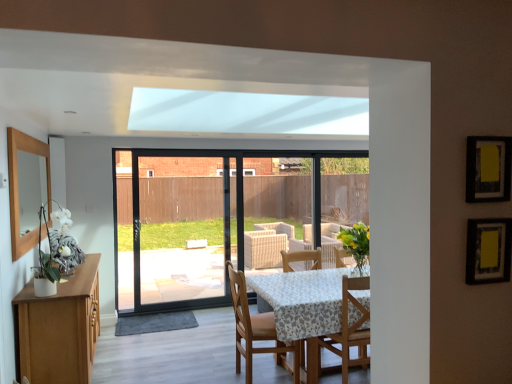
Describe the element at coordinates (349, 331) in the screenshot. The height and width of the screenshot is (384, 512). I see `wooden chair at center, which is counted as the second chair, starting from the left` at that location.

This screenshot has height=384, width=512. Find the location of `wooden chair at center, which is counted as the second chair, starting from the left`. wooden chair at center, which is counted as the second chair, starting from the left is located at coordinates pos(349,331).

Image resolution: width=512 pixels, height=384 pixels. Describe the element at coordinates (255, 328) in the screenshot. I see `wooden chair at center, the 1th chair viewed from the left` at that location.

This screenshot has height=384, width=512. I want to click on wooden chair at center, the 2th chair positioned from the right, so click(x=255, y=328).

Measure the distance between wooden chair at center, the 1th chair viewed from the left, and camera.

The depth of wooden chair at center, the 1th chair viewed from the left, is 3.31 meters.

Locate an element on the screen. The height and width of the screenshot is (384, 512). wooden chair at center, which is counted as the second chair, starting from the left is located at coordinates (349, 331).

Visually, is wooden chair at center, the 1th chair viewed from the left, positioned to the left or to the right of wooden chair at center, placed as the 1th chair when sorted from right to left?

wooden chair at center, the 1th chair viewed from the left, is to the left of wooden chair at center, placed as the 1th chair when sorted from right to left.

Which is behind, wooden chair at center, the 1th chair viewed from the left, or wooden chair at center, which is counted as the second chair, starting from the left?

wooden chair at center, the 1th chair viewed from the left, is more distant.

Is point (229, 271) closer or farther from the camera than point (345, 307)?

Point (229, 271) is farther from the camera than point (345, 307).

From the image's perspective, is wooden chair at center, the 1th chair viewed from the left, beneath wooden chair at center, which is counted as the second chair, starting from the left?

Yes, from the image's perspective, wooden chair at center, the 1th chair viewed from the left, is below wooden chair at center, which is counted as the second chair, starting from the left.

From a real-world perspective, is wooden chair at center, the 1th chair viewed from the left, positioned above or below wooden chair at center, placed as the 1th chair when sorted from right to left?

In terms of real-world spatial position, wooden chair at center, the 1th chair viewed from the left, is below wooden chair at center, placed as the 1th chair when sorted from right to left.

Between wooden chair at center, the 2th chair positioned from the right, and wooden chair at center, placed as the 1th chair when sorted from right to left, which one has larger width?

With larger width is wooden chair at center, the 2th chair positioned from the right.

Is wooden chair at center, the 2th chair positioned from the right, shorter than wooden chair at center, placed as the 1th chair when sorted from right to left?

No, wooden chair at center, the 2th chair positioned from the right, is not shorter than wooden chair at center, placed as the 1th chair when sorted from right to left.

Considering the sizes of objects wooden chair at center, the 1th chair viewed from the left, and wooden chair at center, placed as the 1th chair when sorted from right to left, in the image provided, who is bigger, wooden chair at center, the 1th chair viewed from the left, or wooden chair at center, placed as the 1th chair when sorted from right to left,?

wooden chair at center, the 1th chair viewed from the left, is bigger.

Choose the correct answer: Is wooden chair at center, the 2th chair positioned from the right, inside wooden chair at center, which is counted as the second chair, starting from the left, or outside it?

wooden chair at center, the 2th chair positioned from the right, is not enclosed by wooden chair at center, which is counted as the second chair, starting from the left.

Are wooden chair at center, the 1th chair viewed from the left, and wooden chair at center, which is counted as the second chair, starting from the left, far apart?

wooden chair at center, the 1th chair viewed from the left, is near wooden chair at center, which is counted as the second chair, starting from the left, not far away.

Is wooden chair at center, the 2th chair positioned from the right, oriented away from wooden chair at center, which is counted as the second chair, starting from the left?

No, wooden chair at center, the 2th chair positioned from the right,'s orientation is not away from wooden chair at center, which is counted as the second chair, starting from the left.

You are a GUI agent. You are given a task and a screenshot of the screen. Output one action in this format:
    pyautogui.click(x=<x>, y=<y>)
    Task: Click on the chair in front of the wooden chair at center, the 2th chair positioned from the right
    This screenshot has height=384, width=512.
    Given the screenshot: What is the action you would take?
    pyautogui.click(x=349, y=331)

Is wooden chair at center, which is counted as the second chair, starting from the left, at the right side of wooden chair at center, the 2th chair positioned from the right?

Correct, you'll find wooden chair at center, which is counted as the second chair, starting from the left, to the right of wooden chair at center, the 2th chair positioned from the right.

Does wooden chair at center, which is counted as the second chair, starting from the left, come in front of wooden chair at center, the 1th chair viewed from the left?

Yes, it is.

Which is closer to the camera, (x=347, y=360) or (x=257, y=336)?

Point (x=347, y=360) is closer to the camera than point (x=257, y=336).

From the image's perspective, would you say wooden chair at center, placed as the 1th chair when sorted from right to left, is positioned over wooden chair at center, the 1th chair viewed from the left?

Yes.

From a real-world perspective, is wooden chair at center, placed as the 1th chair when sorted from right to left, physically above wooden chair at center, the 1th chair viewed from the left?

Indeed, from a real-world perspective, wooden chair at center, placed as the 1th chair when sorted from right to left, stands above wooden chair at center, the 1th chair viewed from the left.

Looking at their sizes, would you say wooden chair at center, placed as the 1th chair when sorted from right to left, is wider or thinner than wooden chair at center, the 2th chair positioned from the right?

Considering their sizes, wooden chair at center, placed as the 1th chair when sorted from right to left, looks slimmer than wooden chair at center, the 2th chair positioned from the right.

Considering the relative sizes of wooden chair at center, placed as the 1th chair when sorted from right to left, and wooden chair at center, the 2th chair positioned from the right, in the image provided, is wooden chair at center, placed as the 1th chair when sorted from right to left, taller than wooden chair at center, the 2th chair positioned from the right,?

No, wooden chair at center, placed as the 1th chair when sorted from right to left, is not taller than wooden chair at center, the 2th chair positioned from the right.

Considering the relative sizes of wooden chair at center, which is counted as the second chair, starting from the left, and wooden chair at center, the 2th chair positioned from the right, in the image provided, is wooden chair at center, which is counted as the second chair, starting from the left, smaller than wooden chair at center, the 2th chair positioned from the right,?

Indeed, wooden chair at center, which is counted as the second chair, starting from the left, has a smaller size compared to wooden chair at center, the 2th chair positioned from the right.

Can we say wooden chair at center, placed as the 1th chair when sorted from right to left, lies outside wooden chair at center, the 1th chair viewed from the left?

Yes, wooden chair at center, placed as the 1th chair when sorted from right to left, is outside of wooden chair at center, the 1th chair viewed from the left.

Is wooden chair at center, which is counted as the second chair, starting from the left, not near wooden chair at center, the 2th chair positioned from the right?

No, wooden chair at center, which is counted as the second chair, starting from the left, is not far from wooden chair at center, the 2th chair positioned from the right.

Could you tell me if wooden chair at center, placed as the 1th chair when sorted from right to left, is turned towards wooden chair at center, the 1th chair viewed from the left?

No, wooden chair at center, placed as the 1th chair when sorted from right to left, is not facing towards wooden chair at center, the 1th chair viewed from the left.

What's the angular difference between wooden chair at center, which is counted as the second chair, starting from the left, and wooden chair at center, the 2th chair positioned from the right,'s facing directions?

90 degrees.

Locate an element on the screen. This screenshot has width=512, height=384. chair lying in front of the wooden chair at center, the 1th chair viewed from the left is located at coordinates (349, 331).

Image resolution: width=512 pixels, height=384 pixels. Find the location of `chair that is on the right side of wooden chair at center, the 1th chair viewed from the left`. chair that is on the right side of wooden chair at center, the 1th chair viewed from the left is located at coordinates (349, 331).

Where is `chair in front of the wooden chair at center, the 2th chair positioned from the right`? chair in front of the wooden chair at center, the 2th chair positioned from the right is located at coordinates (x=349, y=331).